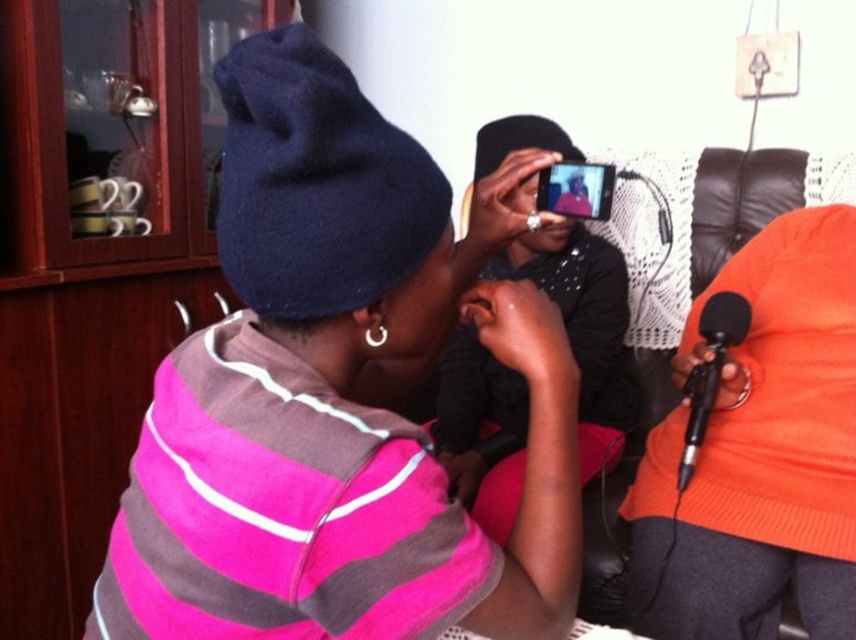
Can you confirm if orange knitted sweater at right is positioned below black metallic microphone at lower right?

No, orange knitted sweater at right is not below black metallic microphone at lower right.

Does orange knitted sweater at right appear on the left side of black metallic microphone at lower right?

Incorrect, orange knitted sweater at right is not on the left side of black metallic microphone at lower right.

Between point (837, 609) and point (700, 422), which one is positioned behind?

Positioned behind is point (700, 422).

The width and height of the screenshot is (856, 640). Identify the location of orange knitted sweater at right. (759, 452).

Does matte black beanie at upper left have a larger size compared to orange knitted sweater at right?

Actually, matte black beanie at upper left might be smaller than orange knitted sweater at right.

Is matte black beanie at upper left to the right of orange knitted sweater at right from the viewer's perspective?

Incorrect, matte black beanie at upper left is not on the right side of orange knitted sweater at right.

Does point (217, 72) come behind point (700, 545)?

No, it is not.

Where is `matte black beanie at upper left`? The height and width of the screenshot is (640, 856). matte black beanie at upper left is located at coordinates (331, 400).

Is matte black beanie at upper left below black metallic microphone at lower right?

No, matte black beanie at upper left is not below black metallic microphone at lower right.

Is point (357, 428) farther from viewer compared to point (742, 312)?

No, (357, 428) is in front of (742, 312).

Does point (263, 97) come closer to viewer compared to point (684, 486)?

That is True.

Identify the location of matte black beanie at upper left. The height and width of the screenshot is (640, 856). (331, 400).